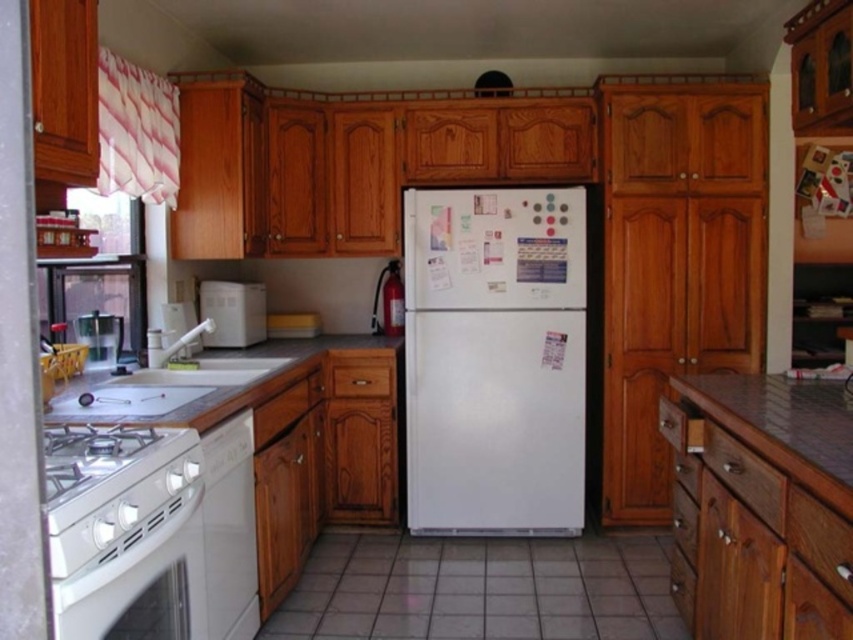
Who is positioned more to the right, white matte refrigerator at center or metallic silver sink at left?

white matte refrigerator at center is more to the right.

Who is lower down, white matte refrigerator at center or metallic silver sink at left?

white matte refrigerator at center

Which is behind, point (486, 403) or point (114, 316)?

Positioned behind is point (486, 403).

This screenshot has height=640, width=853. What are the coordinates of `white matte refrigerator at center` in the screenshot? It's located at (495, 360).

Based on the photo, who is higher up, white glossy oven at lower left or metallic silver counter top at lower right?

Positioned higher is metallic silver counter top at lower right.

Can you confirm if white glossy oven at lower left is positioned above metallic silver counter top at lower right?

No.

In order to click on white glossy oven at lower left in this screenshot , I will do `click(120, 522)`.

Identify the location of white glossy oven at lower left. (120, 522).

Between point (253, 500) and point (120, 324), which one is positioned behind?

The point (120, 324) is more distant.

Is white glossy dishwasher at lower left bigger than metallic silver sink at left?

Correct, white glossy dishwasher at lower left is larger in size than metallic silver sink at left.

Describe the element at coordinates (230, 529) in the screenshot. This screenshot has height=640, width=853. I see `white glossy dishwasher at lower left` at that location.

Find the location of a particular element. Image resolution: width=853 pixels, height=640 pixels. white glossy dishwasher at lower left is located at coordinates tap(230, 529).